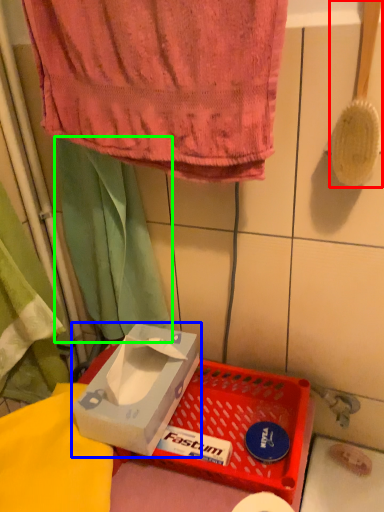
Question: Which object is the farthest from brush (highlighted by a red box)? Choose among these: box (highlighted by a blue box) or curtain (highlighted by a green box).

Choices:
 (A) box
 (B) curtain

Answer: (A)